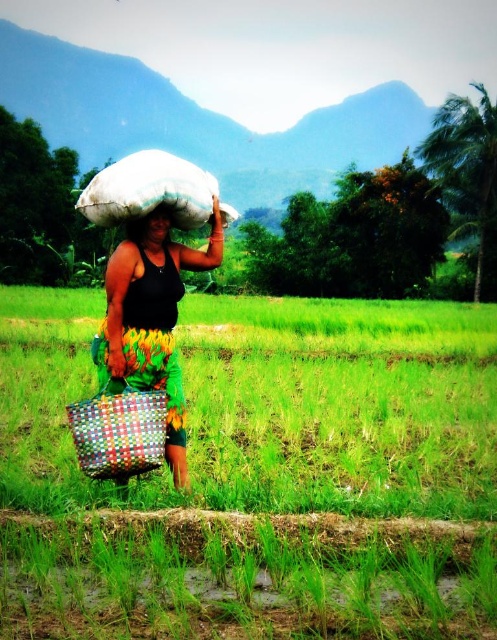
In the scene shown: You are a photographer trying to capture the woman in the image. You want to ensure that both the multicolored woven basket at lower left and the matte black head at upper center are clearly visible in your shot. Given their sizes, which object should you focus on first to ensure proper framing?

The multicolored woven basket at lower left is bigger than the matte black head at upper center, so you should focus on the multicolored woven basket at lower left first to ensure it fits well within the frame before adjusting for the smaller matte black head at upper center.

You are standing in the rice paddy field and see two points marked in the image. Which point is closer to you, point (166,275) or point (186,164)?

Point (166,275) is closer to you because it is further to the viewer than point (186,164).

You are a traveler who wants to carry both the multicolored woven basket at center and the white fabric sack at center. Which object has a smaller width and would be easier to fit through a narrow doorway?

The multicolored woven basket at center has a smaller width than the white fabric sack at center, so it would be easier to fit through a narrow doorway.